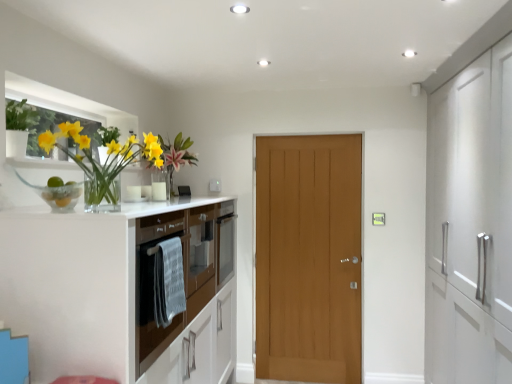
Question: From the image's perspective, does brown glossy oven at left appear higher than translucent glass vase at left?

Choices:
 (A) no
 (B) yes

Answer: (A)

Question: Can you confirm if brown glossy oven at left is taller than translucent glass vase at left?

Choices:
 (A) yes
 (B) no

Answer: (A)

Question: Is there a large distance between brown glossy oven at left and translucent glass vase at left?

Choices:
 (A) yes
 (B) no

Answer: (B)

Question: Can you confirm if brown glossy oven at left is wider than translucent glass vase at left?

Choices:
 (A) yes
 (B) no

Answer: (A)

Question: Is brown glossy oven at left thinner than translucent glass vase at left?

Choices:
 (A) no
 (B) yes

Answer: (A)

Question: Is light brown wood door at center situated inside brown glossy oven at left or outside?

Choices:
 (A) outside
 (B) inside

Answer: (A)

Question: From the image's perspective, is light brown wood door at center located above or below brown glossy oven at left?

Choices:
 (A) above
 (B) below

Answer: (B)

Question: In terms of width, does light brown wood door at center look wider or thinner when compared to brown glossy oven at left?

Choices:
 (A) thin
 (B) wide

Answer: (A)

Question: Is point (351, 322) closer or farther from the camera than point (114, 233)?

Choices:
 (A) closer
 (B) farther

Answer: (B)

Question: Does point (42, 304) appear closer or farther from the camera than point (10, 125)?

Choices:
 (A) farther
 (B) closer

Answer: (B)

Question: Considering the positions of brown glossy oven at left and green matte plant at upper left in the image, is brown glossy oven at left taller or shorter than green matte plant at upper left?

Choices:
 (A) short
 (B) tall

Answer: (B)

Question: Is brown glossy oven at left bigger or smaller than green matte plant at upper left?

Choices:
 (A) big
 (B) small

Answer: (A)

Question: Is brown glossy oven at left wider or thinner than green matte plant at upper left?

Choices:
 (A) thin
 (B) wide

Answer: (B)

Question: Is green matte plant at upper left inside or outside of brown glossy oven at left?

Choices:
 (A) outside
 (B) inside

Answer: (A)

Question: Looking at the image, does green matte plant at upper left seem bigger or smaller compared to brown glossy oven at left?

Choices:
 (A) big
 (B) small

Answer: (B)